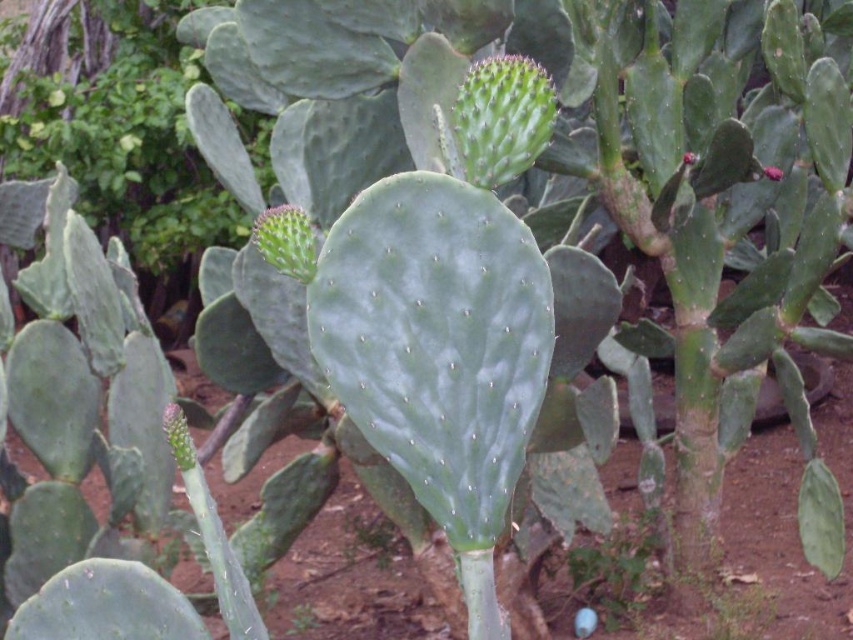
Looking at this image, can you confirm if matte pink flower at center is positioned below smooth red flower at upper right?

Correct, matte pink flower at center is located below smooth red flower at upper right.

Between matte pink flower at center and smooth red flower at upper right, which one is positioned higher?

smooth red flower at upper right is higher up.

What do you see at coordinates (772, 172) in the screenshot?
I see `matte pink flower at center` at bounding box center [772, 172].

The width and height of the screenshot is (853, 640). What are the coordinates of `matte pink flower at center` in the screenshot? It's located at (772, 172).